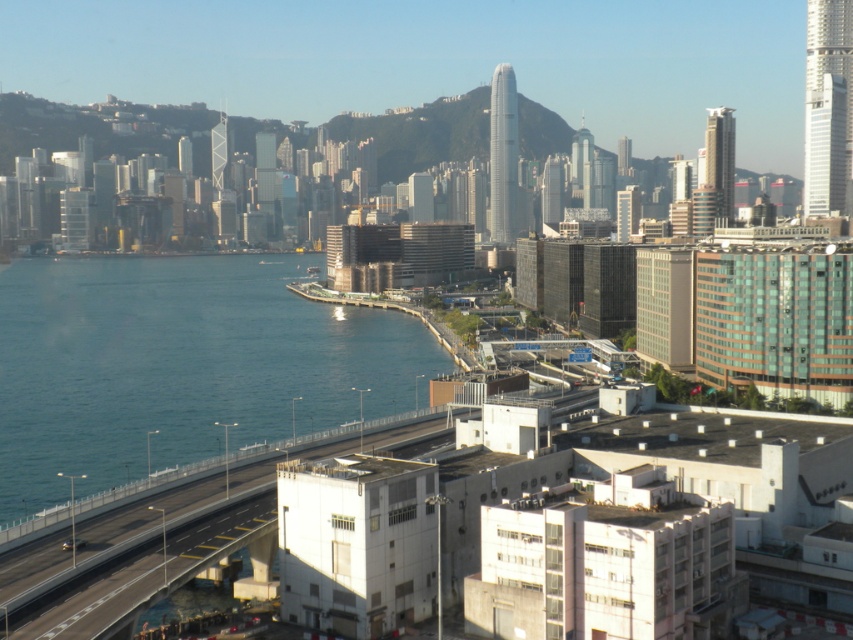
Between blue water at lower left and concrete bridge at lower center, which one is positioned lower?

Positioned lower is concrete bridge at lower center.

This screenshot has height=640, width=853. What do you see at coordinates (178, 365) in the screenshot? I see `blue water at lower left` at bounding box center [178, 365].

I want to click on blue water at lower left, so click(178, 365).